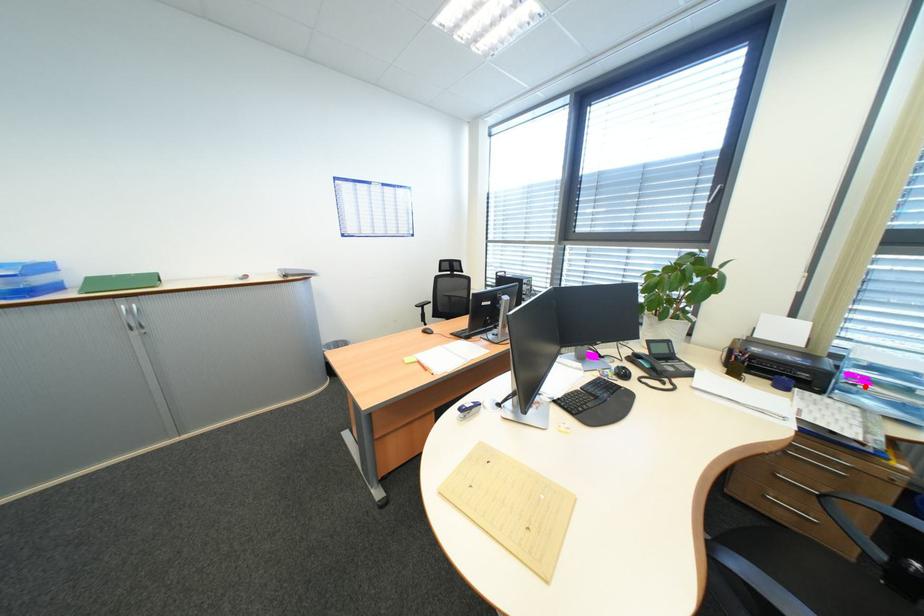
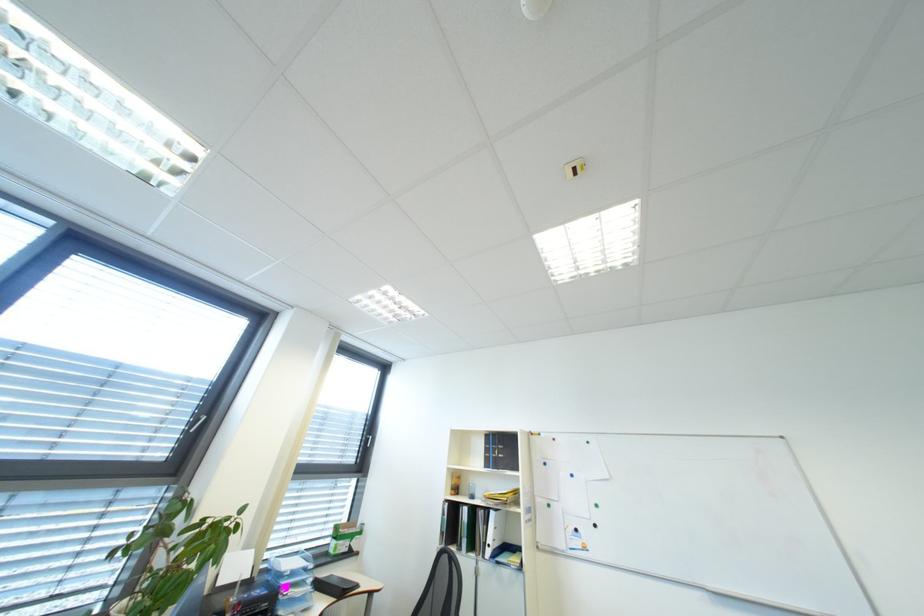
Where in the second image is the point corresponding to the highlighted location from the first image?

(298, 596)